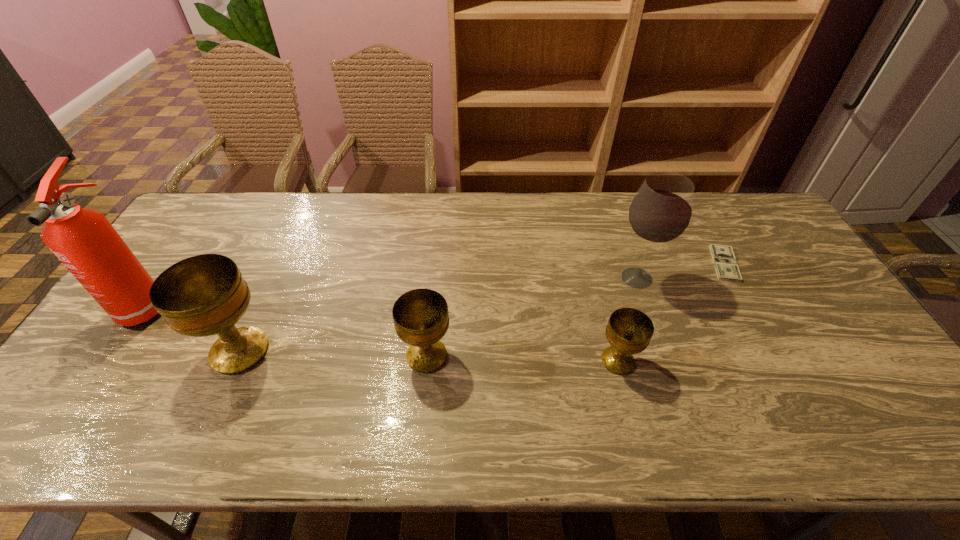
Image resolution: width=960 pixels, height=540 pixels. Identify the location of blank region between the leftmost object and the second tallest chalice. (287, 330).

Select which object appears as the fourth closest to the fire extinguisher. Please provide its 2D coordinates. Your answer should be formatted as a tuple, i.e. [(x, y)], where the tuple contains the x and y coordinates of a point satisfying the conditions above.

[(660, 212)]

Select which object is the fourth closest to the tallest chalice. Please provide its 2D coordinates. Your answer should be formatted as a tuple, i.e. [(x, y)], where the tuple contains the x and y coordinates of a point satisfying the conditions above.

[(660, 212)]

At what (x,y) coordinates should I click in order to perform the action: click on chalice that stands as the second closest to the fifth object from right to left. Please return your answer as a coordinate pair (x, y). The image size is (960, 540). Looking at the image, I should click on (629, 331).

Identify which chalice is located as the second nearest to the second tallest object. Please provide its 2D coordinates. Your answer should be formatted as a tuple, i.e. [(x, y)], where the tuple contains the x and y coordinates of a point satisfying the conditions above.

[(421, 319)]